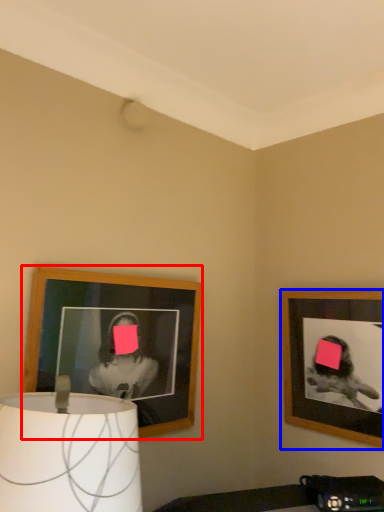
Question: Which object is closer to the camera taking this photo, picture frame (highlighted by a red box) or picture frame (highlighted by a blue box)?

Choices:
 (A) picture frame
 (B) picture frame

Answer: (A)